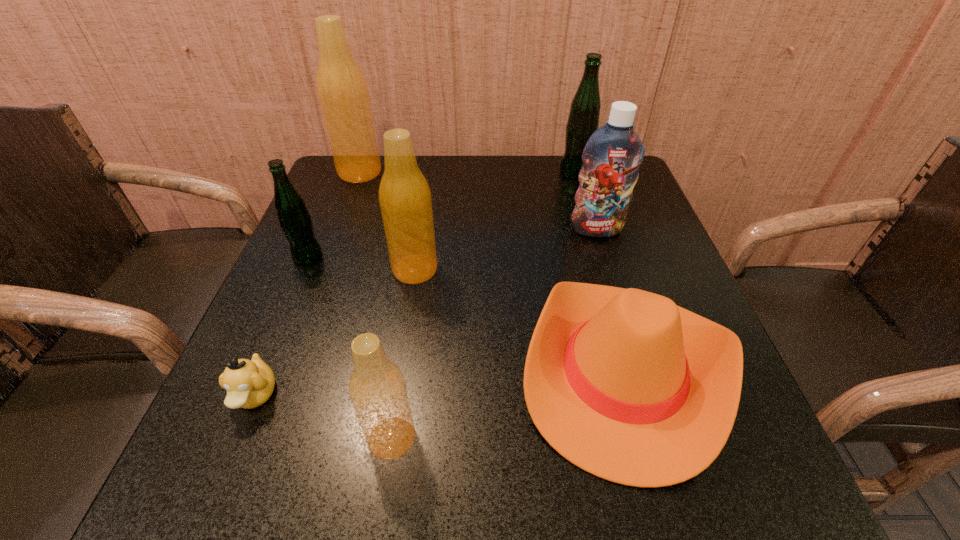
This screenshot has height=540, width=960. I want to click on vacant space that satisfies the following two spatial constraints: 1. on the front side of the nearer green beer bottle; 2. on the left side of the second smallest tan beer bottle, so click(301, 269).